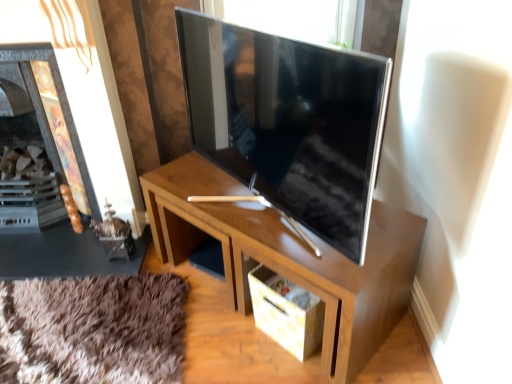
You are a GUI agent. You are given a task and a screenshot of the screen. Output one action in this format:
    pyautogui.click(x=<x>, y=<y>)
    Task: Click on the free space in front of matte cardboard drawer at lower center
    Image resolution: width=512 pixels, height=384 pixels.
    Given the screenshot: What is the action you would take?
    pyautogui.click(x=284, y=371)